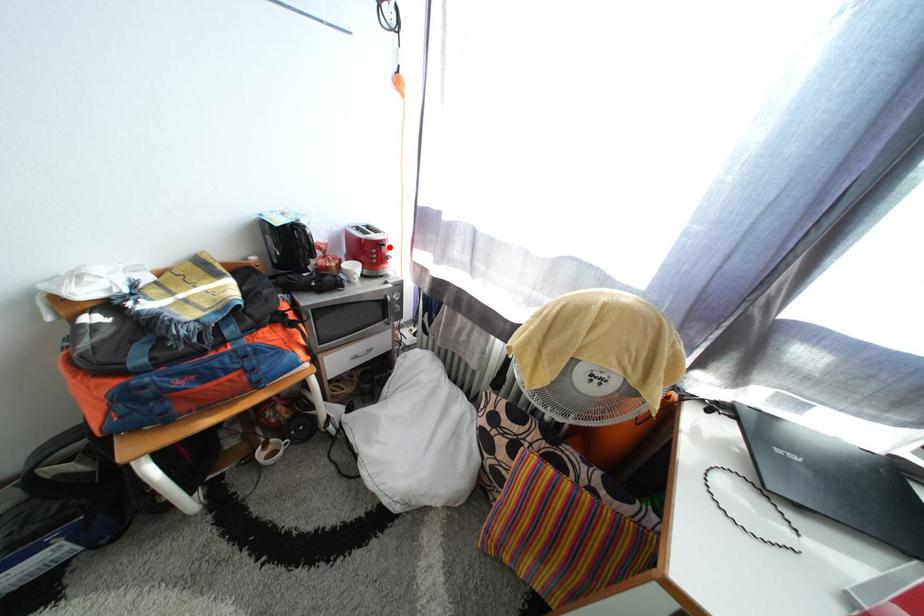
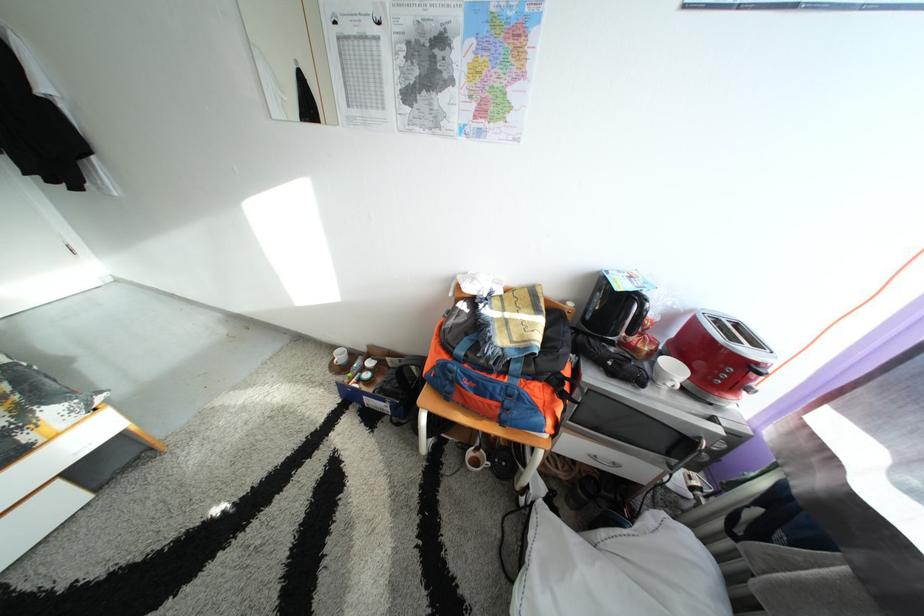
Question: I am providing you with two images of the same scene from different viewpoints. Given a red point in image1, look at the same physical point in image2. Is it:

Choices:
 (A) Closer to the viewpoint
 (B) Farther from the viewpoint

Answer: (B)